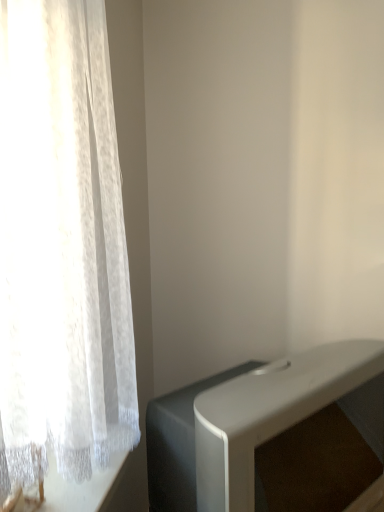
Where is `white plastic drawer at lower right`? white plastic drawer at lower right is located at coordinates [254, 422].

The image size is (384, 512). Describe the element at coordinates (254, 422) in the screenshot. I see `white plastic drawer at lower right` at that location.

What is the approximate width of white plastic drawer at lower right?

23.12 inches.

The height and width of the screenshot is (512, 384). I want to click on white plastic drawer at lower right, so click(254, 422).